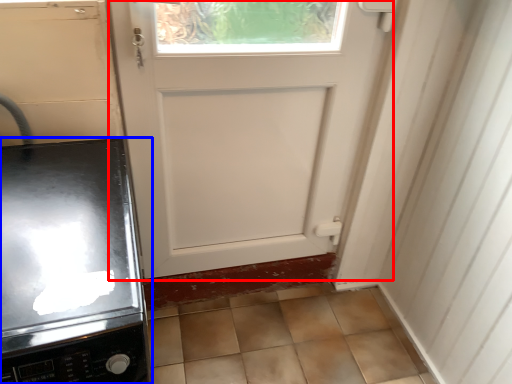
Question: Which object appears closest to the camera in this image, door (highlighted by a red box) or home appliance (highlighted by a blue box)?

Choices:
 (A) door
 (B) home appliance

Answer: (B)